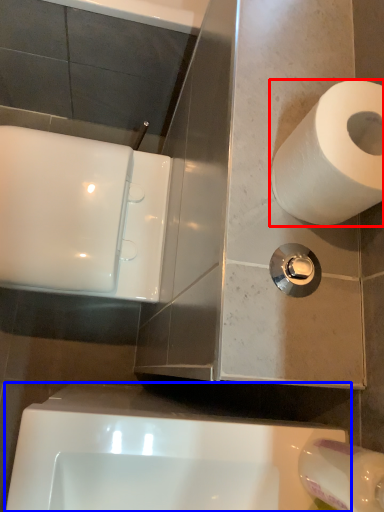
Question: Which object is further to the camera taking this photo, toilet paper (highlighted by a red box) or bath (highlighted by a blue box)?

Choices:
 (A) toilet paper
 (B) bath

Answer: (B)